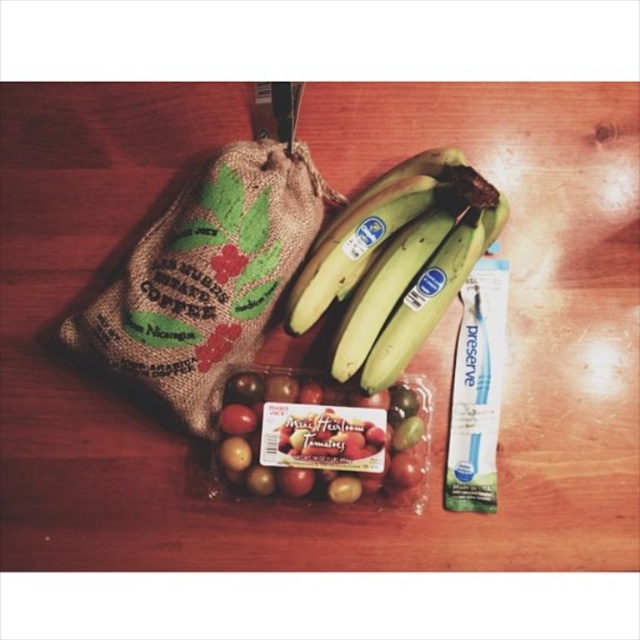
Question: Is burlap coffee bag at upper left further to the viewer compared to green matte bananas at center?

Choices:
 (A) no
 (B) yes

Answer: (B)

Question: Considering the real-world distances, which object is farthest from the burlap coffee bag at upper left?

Choices:
 (A) green matte bananas at center
 (B) blue plastic toothpaste at center right
 (C) shiny red tomatoes at center

Answer: (B)

Question: Considering the relative positions of shiny red tomatoes at center and blue plastic toothpaste at center right in the image provided, where is shiny red tomatoes at center located with respect to blue plastic toothpaste at center right?

Choices:
 (A) below
 (B) above

Answer: (A)

Question: Which point is farther to the camera?

Choices:
 (A) burlap coffee bag at upper left
 (B) shiny red tomatoes at center
 (C) blue plastic toothpaste at center right
 (D) green matte bananas at center

Answer: (B)

Question: Considering the real-world distances, which object is closest to the burlap coffee bag at upper left?

Choices:
 (A) green matte bananas at center
 (B) shiny red tomatoes at center
 (C) blue plastic toothpaste at center right

Answer: (A)

Question: Is burlap coffee bag at upper left wider than shiny red tomatoes at center?

Choices:
 (A) no
 (B) yes

Answer: (B)